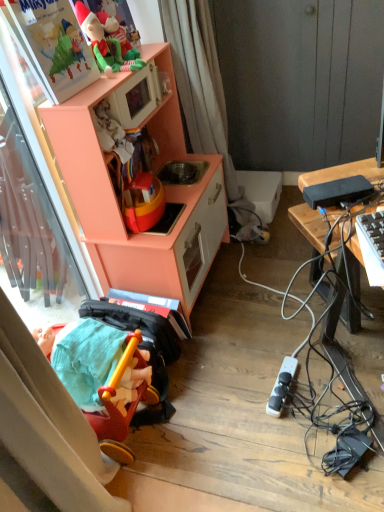
Image resolution: width=384 pixels, height=512 pixels. Find the location of `free space to the back side of black plastic power strip at lower right, acting as the 1th appliance starting from the back`. free space to the back side of black plastic power strip at lower right, acting as the 1th appliance starting from the back is located at coordinates (261, 350).